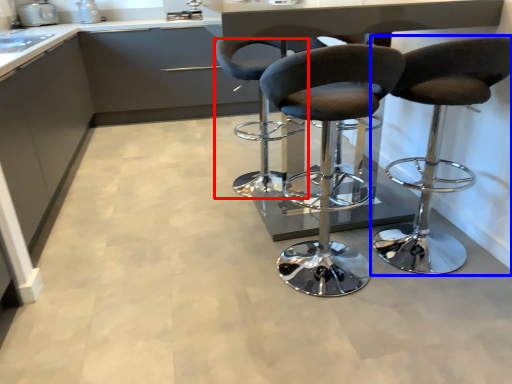
Question: Which object appears farthest to the camera in this image, chair (highlighted by a red box) or chair (highlighted by a blue box)?

Choices:
 (A) chair
 (B) chair

Answer: (A)